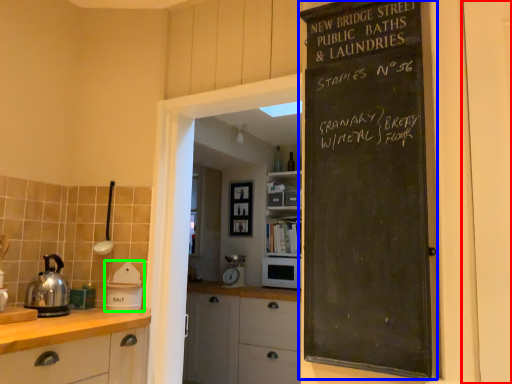
Question: Which object is the farthest from door (highlighted by a red box)? Choose among these: bulletin board (highlighted by a blue box) or appliance (highlighted by a green box).

Choices:
 (A) bulletin board
 (B) appliance

Answer: (B)